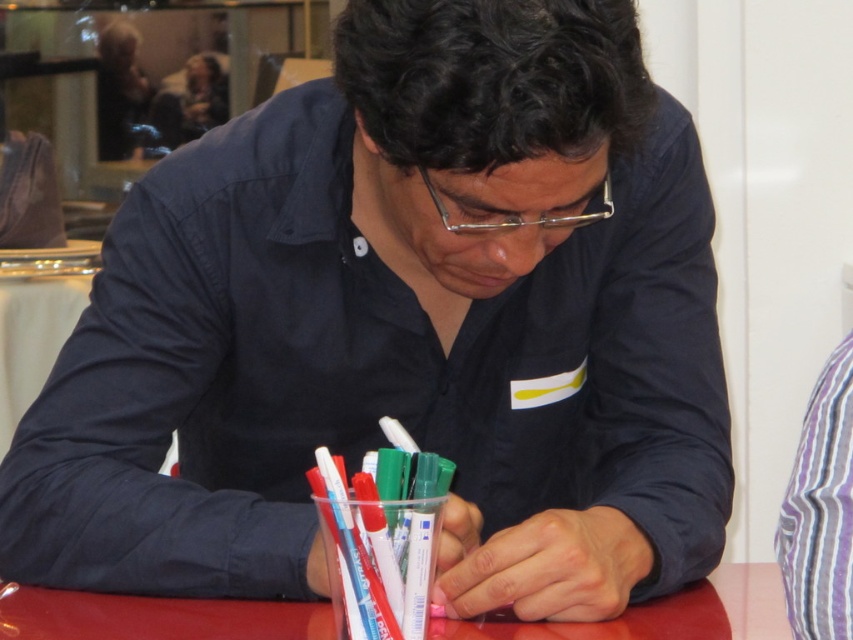
Question: Which point is farther from the camera taking this photo?

Choices:
 (A) (689, 614)
 (B) (799, 593)

Answer: (A)

Question: Can you confirm if red glossy table at center is thinner than purple striped shirt at right?

Choices:
 (A) no
 (B) yes

Answer: (A)

Question: Does red glossy table at center appear under purple striped shirt at right?

Choices:
 (A) yes
 (B) no

Answer: (A)

Question: Where is red glossy table at center located in relation to purple striped shirt at right in the image?

Choices:
 (A) below
 (B) above

Answer: (A)

Question: Which point is closer to the camera taking this photo?

Choices:
 (A) (822, 412)
 (B) (759, 582)

Answer: (A)